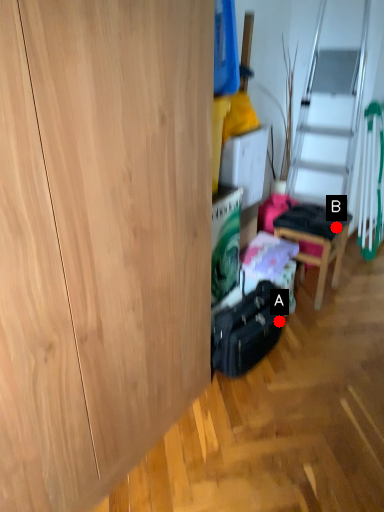
Question: Two points are circled on the image, labeled by A and B beside each circle. Which point is closer to the camera?

Choices:
 (A) A is closer
 (B) B is closer

Answer: (A)